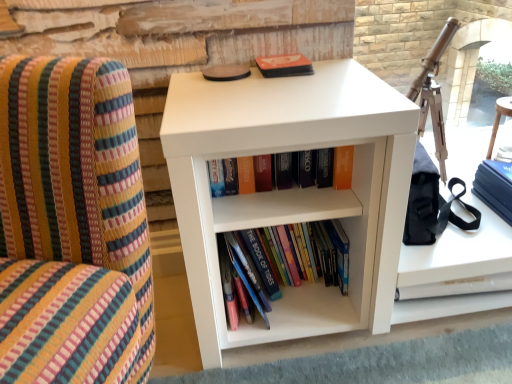
Question: Can you confirm if matte orange paperback book at upper center, marked as the second paperback book in a right-to-left arrangement, is smaller than white matte bookshelf at center?

Choices:
 (A) yes
 (B) no

Answer: (A)

Question: Would you say matte orange paperback book at upper center, marked as the first paperback book in a left-to-right arrangement, contains white matte bookshelf at center?

Choices:
 (A) yes
 (B) no

Answer: (B)

Question: Does matte orange paperback book at upper center, marked as the first paperback book in a left-to-right arrangement, come in front of white matte bookshelf at center?

Choices:
 (A) no
 (B) yes

Answer: (A)

Question: From the image's perspective, does matte orange paperback book at upper center, the first paperback book in the top-to-bottom sequence, appear lower than white matte bookshelf at center?

Choices:
 (A) no
 (B) yes

Answer: (A)

Question: Is matte orange paperback book at upper center, marked as the second paperback book in a right-to-left arrangement, to the right of white matte bookshelf at center from the viewer's perspective?

Choices:
 (A) no
 (B) yes

Answer: (A)

Question: In the image, is white matte bookshelf at center positioned in front of or behind hardcover books at center, positioned as the second book in top-to-bottom order?

Choices:
 (A) front
 (B) behind

Answer: (A)

Question: Looking at their shapes, would you say white matte bookshelf at center is wider or thinner than hardcover books at center, arranged as the 1th book when ordered from the bottom?

Choices:
 (A) thin
 (B) wide

Answer: (B)

Question: Do you think white matte bookshelf at center is within hardcover books at center, arranged as the 1th book when ordered from the bottom, or outside of it?

Choices:
 (A) outside
 (B) inside

Answer: (A)

Question: From a real-world perspective, is white matte bookshelf at center positioned above or below hardcover books at center, positioned as the second book in top-to-bottom order?

Choices:
 (A) below
 (B) above

Answer: (B)

Question: From the image's perspective, is hardcover books at center, positioned as the second book in top-to-bottom order, above or below white matte bookshelf at center?

Choices:
 (A) above
 (B) below

Answer: (B)

Question: Is hardcover books at center, positioned as the second book in top-to-bottom order, in front of or behind white matte bookshelf at center in the image?

Choices:
 (A) front
 (B) behind

Answer: (B)

Question: Based on their positions, is hardcover books at center, arranged as the 1th book when ordered from the bottom, located to the left or right of white matte bookshelf at center?

Choices:
 (A) left
 (B) right

Answer: (A)

Question: In terms of width, does hardcover books at center, positioned as the second book in top-to-bottom order, look wider or thinner when compared to white matte bookshelf at center?

Choices:
 (A) thin
 (B) wide

Answer: (A)

Question: From a real-world perspective, is hardcover books at center, arranged as the 1th book when ordered from the bottom, physically located above or below matte orange book at center, positioned as the second book in bottom-to-top order?

Choices:
 (A) below
 (B) above

Answer: (A)

Question: Is hardcover books at center, arranged as the 1th book when ordered from the bottom, taller or shorter than matte orange book at center, positioned as the second book in bottom-to-top order?

Choices:
 (A) tall
 (B) short

Answer: (A)